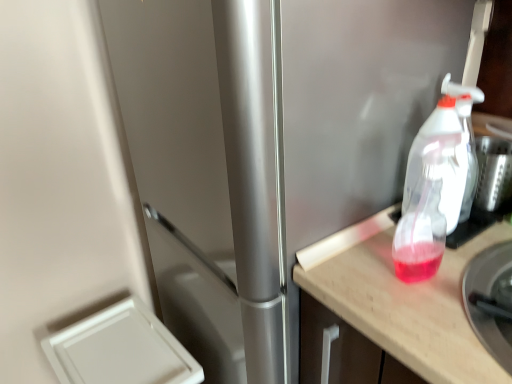
In order to click on space that is in front of transparent plastic spray bottle at right in this screenshot , I will do `click(451, 265)`.